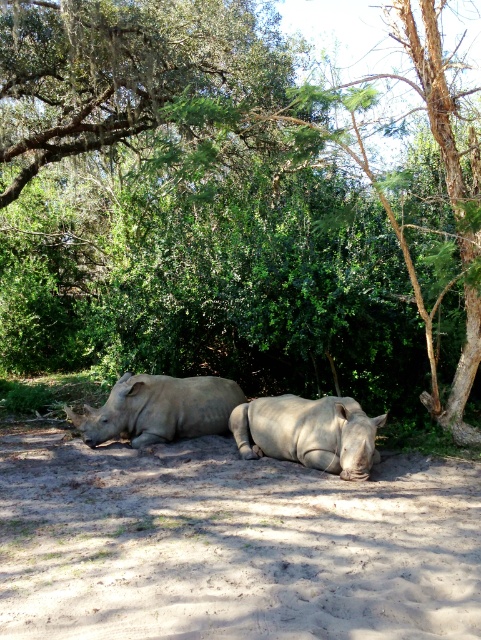
Who is positioned more to the left, sandy brown dirt at lower center or gray matte rhinoceros at center?

gray matte rhinoceros at center

This screenshot has height=640, width=481. I want to click on sandy brown dirt at lower center, so click(231, 545).

Who is more forward, (27, 493) or (165, 432)?

Point (27, 493) is in front.

Locate an element on the screen. sandy brown dirt at lower center is located at coordinates (231, 545).

Who is shorter, smooth gray rhino at center or gray matte rhinoceros at center?

Standing shorter between the two is smooth gray rhino at center.

Find the location of a particular element. smooth gray rhino at center is located at coordinates (308, 433).

Is brown textured tree at center below smooth gray rhino at center?

No, brown textured tree at center is not below smooth gray rhino at center.

Who is taller, brown textured tree at center or smooth gray rhino at center?

brown textured tree at center is taller.

Who is more forward, (332, 172) or (244, 404)?

Point (244, 404) is in front.

You are a GUI agent. You are given a task and a screenshot of the screen. Output one action in this format:
    pyautogui.click(x=<x>, y=<y>)
    Task: Click on the brown textured tree at center
    The image size is (481, 640).
    Given the screenshot: What is the action you would take?
    pyautogui.click(x=203, y=211)